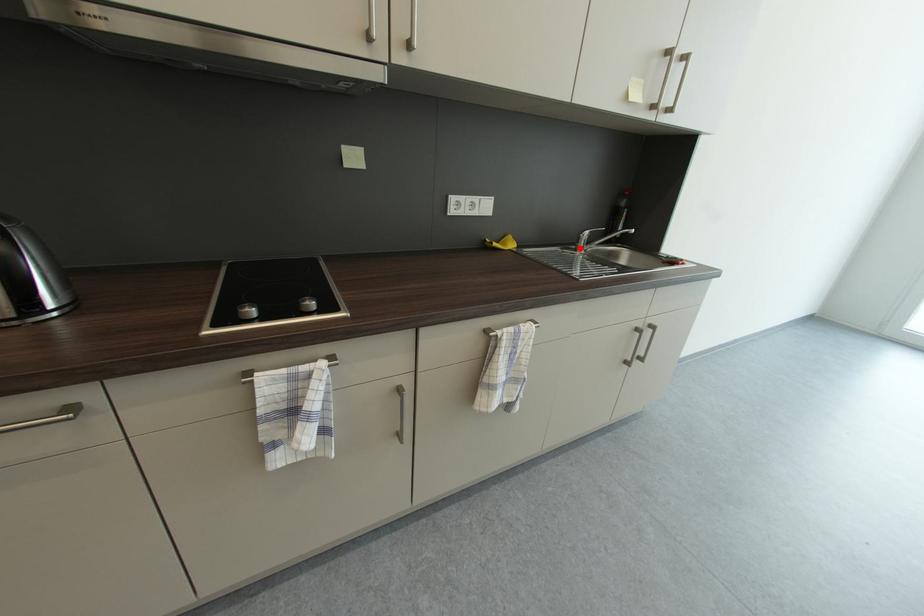
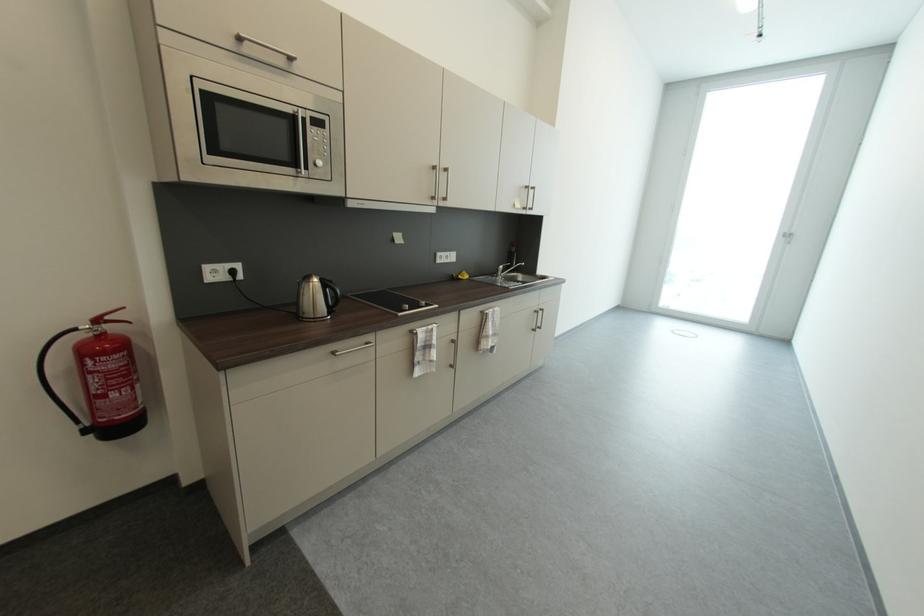
Find the pixel in the second image that matches the highlighted location in the first image.

(502, 277)